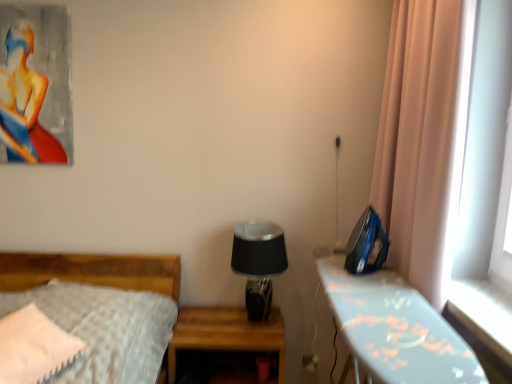
Question: Considering the positions of point (185, 319) and point (7, 124), is point (185, 319) closer or farther from the camera than point (7, 124)?

Choices:
 (A) farther
 (B) closer

Answer: (A)

Question: Relative to matte acrylic painting of a woman at upper left, is wooden nightstand at center, the first nightstand in the left-to-right sequence, in front or behind?

Choices:
 (A) behind
 (B) front

Answer: (B)

Question: Estimate the real-world distances between objects in this image. Which object is closer to the white plastic electric outlet at lower center?

Choices:
 (A) wooden nightstand at center, the first nightstand in the left-to-right sequence
 (B) black glass table lamp at center
 (C) blue plastic iron at right, arranged as the 2th nightstand when viewed from the left
 (D) matte acrylic painting of a woman at upper left
 (E) white fluffy pillow at lower left

Answer: (A)

Question: Considering the real-world distances, which object is farthest from the white plastic electric outlet at lower center?

Choices:
 (A) black glass table lamp at center
 (B) matte acrylic painting of a woman at upper left
 (C) wooden nightstand at center, which is the second nightstand in right-to-left order
 (D) blue plastic iron at right, which is the first nightstand in right-to-left order
 (E) white fluffy pillow at lower left

Answer: (B)